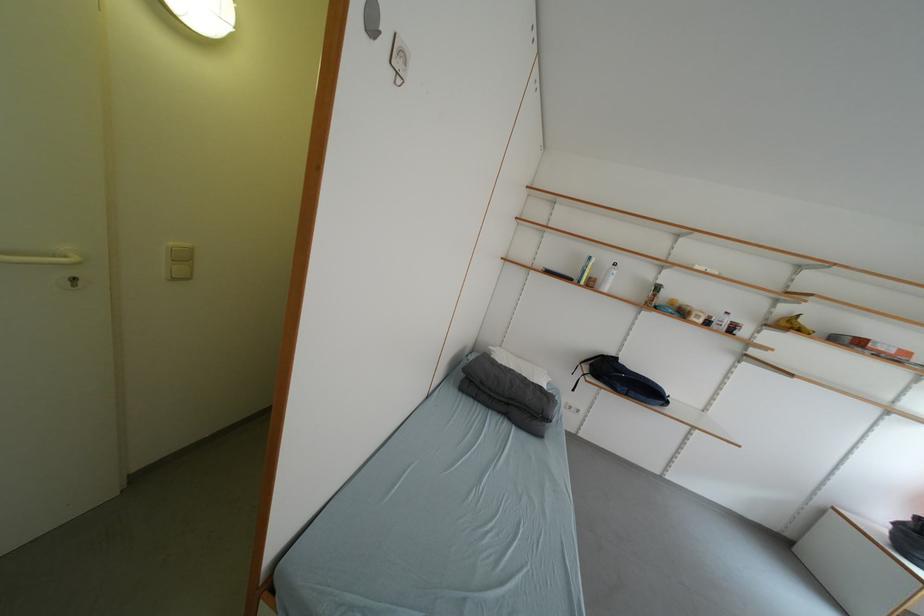
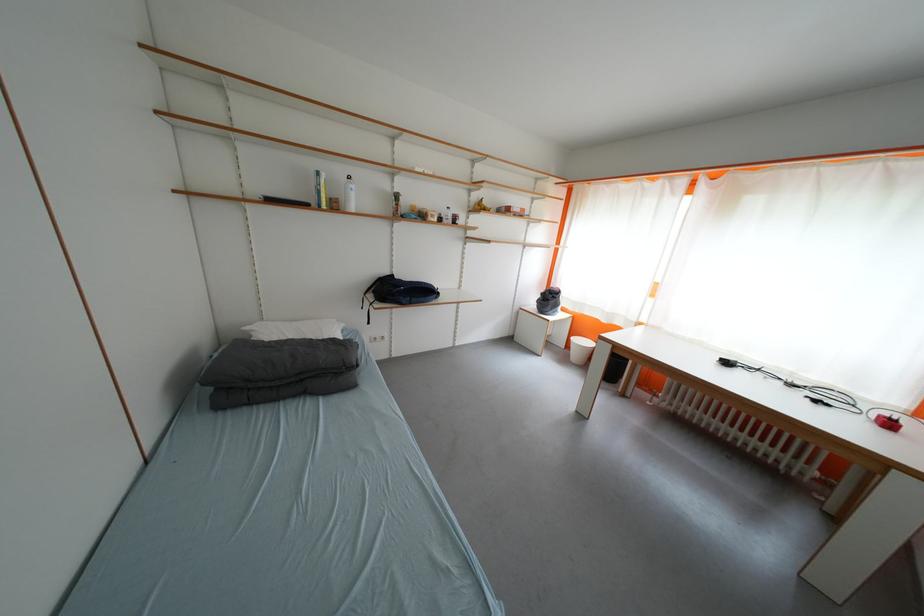
In the second image, find the point that corresponds to (600,286) in the first image.

(344, 209)